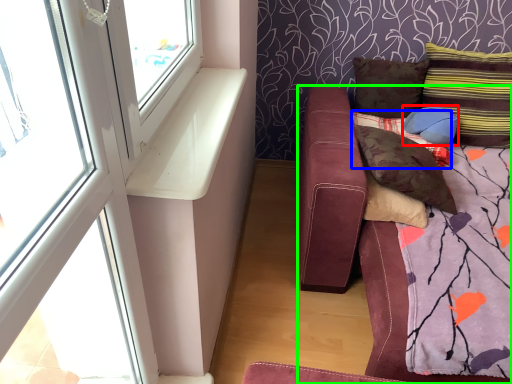
Question: Considering the real-world distances, which object is farthest from pillow (highlighted by a red box)? pillow (highlighted by a blue box) or studio couch (highlighted by a green box)?

Choices:
 (A) pillow
 (B) studio couch

Answer: (B)